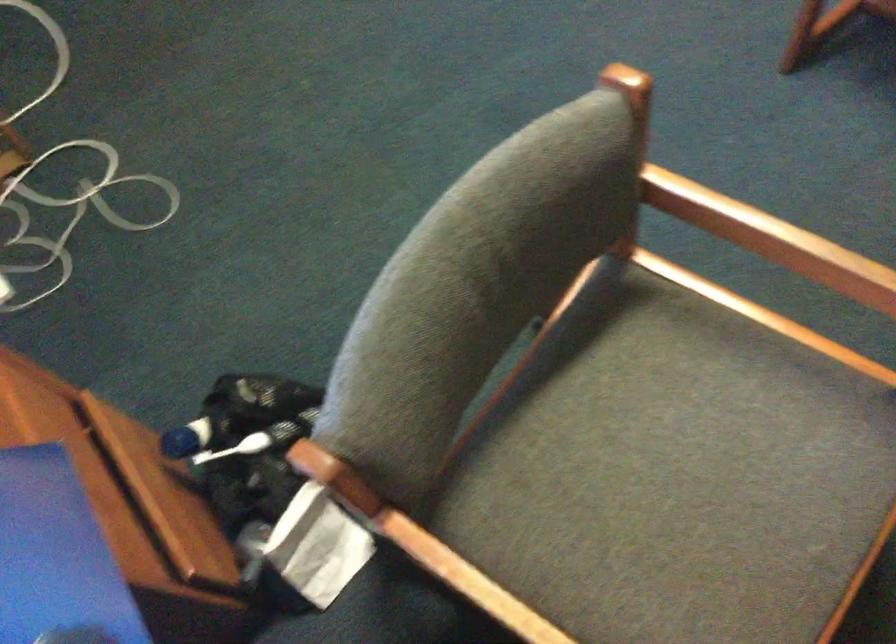
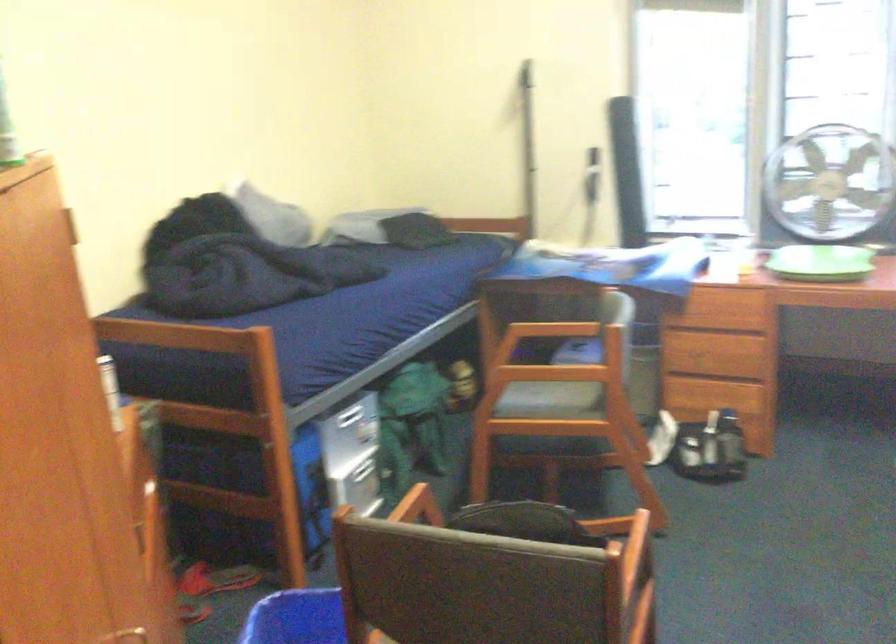
The point at [804,275] is marked in the first image. Where is the corresponding point in the second image?

(540, 375)